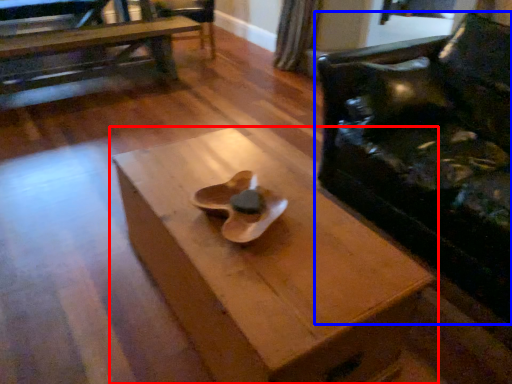
Question: Among these objects, which one is farthest to the camera, table (highlighted by a red box) or chair (highlighted by a blue box)?

Choices:
 (A) table
 (B) chair

Answer: (B)